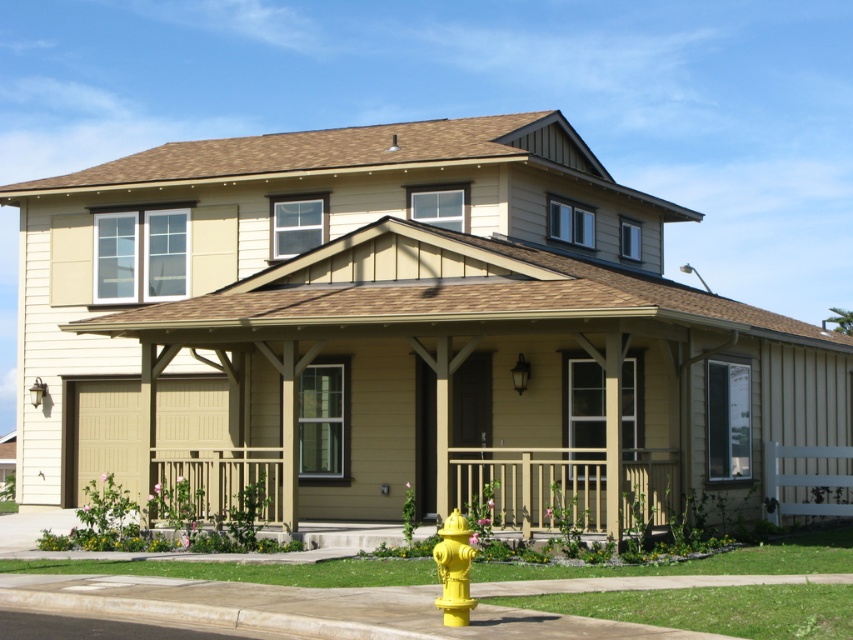
Between wooden railing at center and yellow matte hydrant at lower center, which one is positioned higher?

wooden railing at center is above.

Is wooden railing at center to the left of yellow matte hydrant at lower center from the viewer's perspective?

No, wooden railing at center is not to the left of yellow matte hydrant at lower center.

Between point (471, 472) and point (440, 570), which one is positioned in front?

Point (440, 570)

Find the location of a particular element. The height and width of the screenshot is (640, 853). wooden railing at center is located at coordinates (532, 484).

Who is shorter, yellow plastic curb at lower center or yellow matte hydrant at lower center?

yellow plastic curb at lower center

How much distance is there between yellow plastic curb at lower center and yellow matte hydrant at lower center?

yellow plastic curb at lower center is 34.27 inches from yellow matte hydrant at lower center.

Describe the element at coordinates (318, 611) in the screenshot. I see `yellow plastic curb at lower center` at that location.

Where is `yellow plastic curb at lower center`? yellow plastic curb at lower center is located at coordinates (318, 611).

Does yellow plastic curb at lower center have a larger size compared to wooden railing at center?

Yes, yellow plastic curb at lower center is bigger than wooden railing at center.

Is yellow plastic curb at lower center wider than wooden railing at center?

Yes.

Locate an element on the screen. yellow plastic curb at lower center is located at coordinates (318, 611).